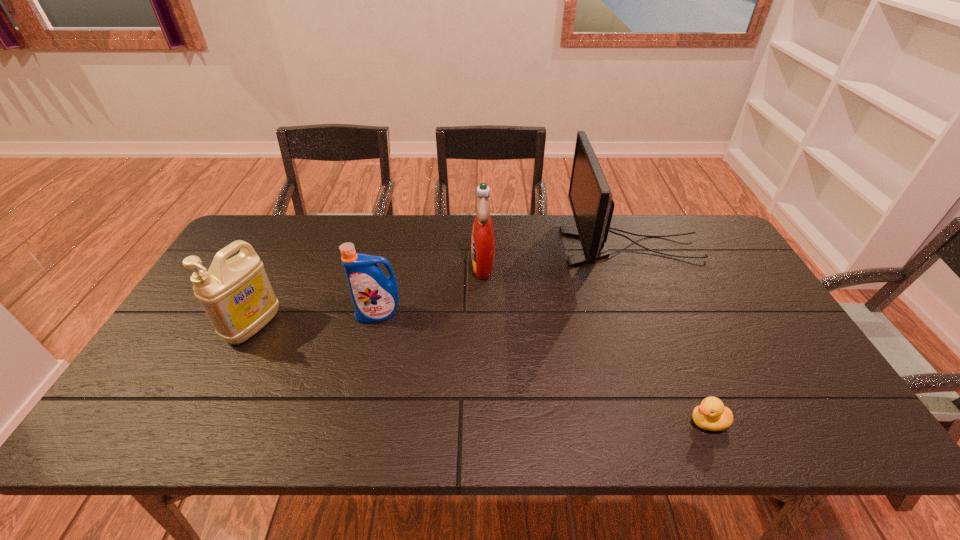
You are a GUI agent. You are given a task and a screenshot of the screen. Output one action in this format:
    pyautogui.click(x=<x>, y=<y>)
    Task: Click on the free space located 0.200m on the front surface of the third object from left to right
    This screenshot has height=540, width=960.
    Given the screenshot: What is the action you would take?
    pyautogui.click(x=407, y=264)

The width and height of the screenshot is (960, 540). Find the location of `vacant position located 0.370m on the front surface of the third object from left to right`. vacant position located 0.370m on the front surface of the third object from left to right is located at coordinates (352, 264).

Find the location of a particular element. The width and height of the screenshot is (960, 540). vacant position located on the front surface of the third object from left to right is located at coordinates (436, 264).

Locate an element on the screen. free region located 0.110m on the left of the leftmost detergent is located at coordinates (189, 326).

I want to click on free location located 0.080m on the label of the second detergent from right to left, so click(371, 347).

At what (x,y) coordinates should I click in order to perform the action: click on free point located on the face of the duckling. Please return your answer as a coordinate pair (x, y). Looking at the image, I should click on (621, 422).

Locate an element on the screen. free spot located on the face of the duckling is located at coordinates (535, 422).

Locate an element on the screen. vacant space located on the face of the duckling is located at coordinates (603, 422).

The image size is (960, 540). I want to click on computer monitor that is at the far edge, so click(x=590, y=197).

Locate an element on the screen. This screenshot has height=540, width=960. detergent located in the far edge section of the desktop is located at coordinates (483, 238).